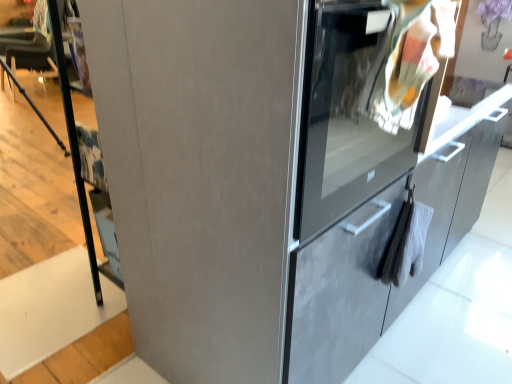
Question: Can you confirm if white matte stair at lower left is thinner than satin gray cabinet at right?

Choices:
 (A) no
 (B) yes

Answer: (A)

Question: Is white matte stair at lower left surrounding satin gray cabinet at right?

Choices:
 (A) yes
 (B) no

Answer: (B)

Question: Does white matte stair at lower left have a greater height compared to satin gray cabinet at right?

Choices:
 (A) yes
 (B) no

Answer: (B)

Question: From a real-world perspective, is white matte stair at lower left positioned over satin gray cabinet at right based on gravity?

Choices:
 (A) no
 (B) yes

Answer: (A)

Question: Does white matte stair at lower left have a larger size compared to satin gray cabinet at right?

Choices:
 (A) no
 (B) yes

Answer: (A)

Question: Considering the positions of white matte stair at lower left and satin gray oven at right in the image, is white matte stair at lower left taller or shorter than satin gray oven at right?

Choices:
 (A) short
 (B) tall

Answer: (A)

Question: From the image's perspective, is white matte stair at lower left above or below satin gray oven at right?

Choices:
 (A) below
 (B) above

Answer: (A)

Question: Is point 11,329 positioned closer to the camera than point 278,380?

Choices:
 (A) farther
 (B) closer

Answer: (A)

Question: Considering their positions, is white matte stair at lower left located in front of or behind satin gray oven at right?

Choices:
 (A) front
 (B) behind

Answer: (B)

Question: Choose the correct answer: Is satin gray oven at right inside white matte stair at lower left or outside it?

Choices:
 (A) inside
 (B) outside

Answer: (B)

Question: Is point (251, 145) closer or farther from the camera than point (121, 309)?

Choices:
 (A) farther
 (B) closer

Answer: (B)

Question: Based on their sizes in the image, would you say satin gray oven at right is bigger or smaller than white matte stair at lower left?

Choices:
 (A) small
 (B) big

Answer: (B)

Question: Considering their positions, is satin gray oven at right located in front of or behind white matte stair at lower left?

Choices:
 (A) front
 (B) behind

Answer: (A)

Question: Visually, is white matte stair at lower left positioned to the left or to the right of satin gray cabinet at right?

Choices:
 (A) left
 (B) right

Answer: (A)

Question: Is white matte stair at lower left in front of or behind satin gray cabinet at right in the image?

Choices:
 (A) behind
 (B) front

Answer: (A)